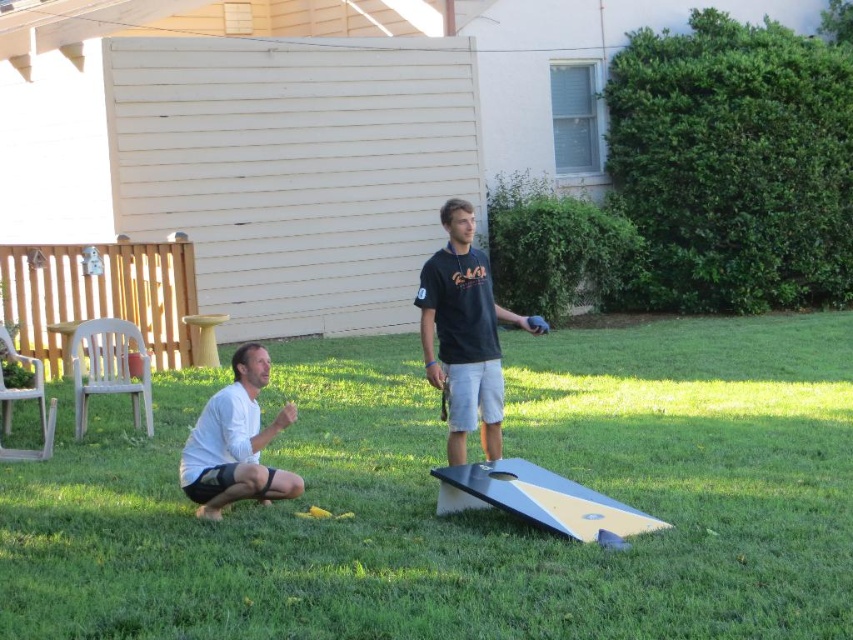
Who is more forward, (730, 381) or (485, 349)?

Point (485, 349)

Does green grass at center appear on the right side of black matte shirt at center?

In fact, green grass at center is to the left of black matte shirt at center.

Does point (795, 458) come farther from viewer compared to point (450, 374)?

Yes, it is behind point (450, 374).

Where is `green grass at center`? The image size is (853, 640). green grass at center is located at coordinates (467, 513).

Between green grass at center and white matte shorts at lower left, which one is positioned higher?

white matte shorts at lower left

Can you confirm if green grass at center is thinner than white matte shorts at lower left?

No, green grass at center is not thinner than white matte shorts at lower left.

Is point (613, 595) closer to viewer compared to point (254, 416)?

Yes.

The image size is (853, 640). I want to click on green grass at center, so click(467, 513).

Measure the distance between black matte shirt at center and camera.

black matte shirt at center and camera are 7.74 meters apart from each other.

Is black matte shirt at center below white matte shorts at lower left?

No, black matte shirt at center is not below white matte shorts at lower left.

Is point (454, 422) closer to camera compared to point (248, 380)?

No.

Locate an element on the screen. black matte shirt at center is located at coordinates (465, 333).